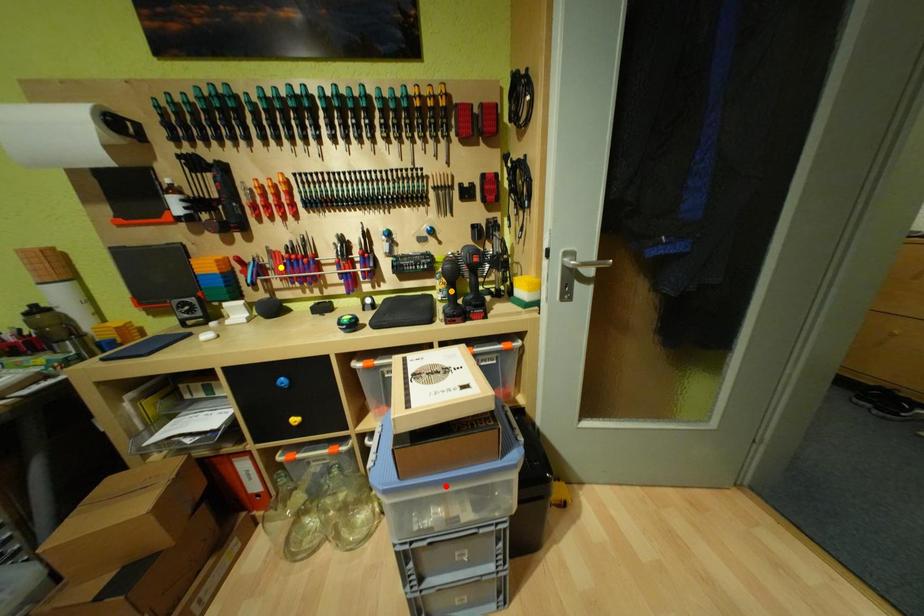
Order these from nearest to farthest:
- orange point
- yellow point
- red point

red point < orange point < yellow point